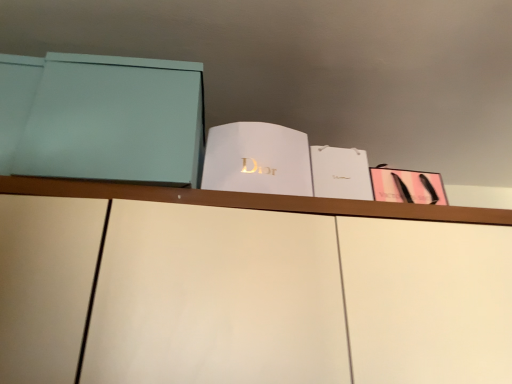
Question: In the image, is matte teal box at left, marked as the first paperback book in a left-to-right arrangement, positioned in front of or behind pink matte paper at upper right, positioned as the 1th paperback book in right-to-left order?

Choices:
 (A) behind
 (B) front

Answer: (B)

Question: Is point (41, 165) positioned closer to the camera than point (373, 192)?

Choices:
 (A) closer
 (B) farther

Answer: (A)

Question: Which of these objects is positioned closest to the white paper at center, marked as the 3th paperback book in a right-to-left arrangement?

Choices:
 (A) pink matte paper at upper right, which is counted as the fourth paperback book, starting from the left
 (B) matte teal box at left, marked as the first paperback book in a left-to-right arrangement
 (C) white paper at center, which appears as the second paperback book when viewed from the right

Answer: (C)

Question: Estimate the real-world distances between objects in this image. Which object is farther from the matte teal box at left, marked as the first paperback book in a left-to-right arrangement?

Choices:
 (A) white paper at center, acting as the second paperback book starting from the left
 (B) pink matte paper at upper right, which is counted as the fourth paperback book, starting from the left
 (C) white paper at center, arranged as the 3th paperback book when viewed from the left

Answer: (B)